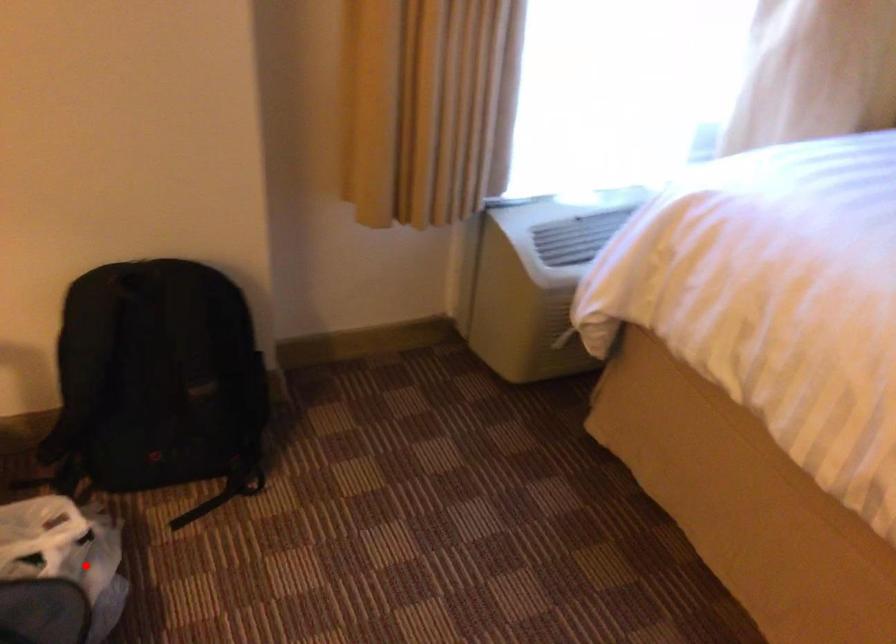
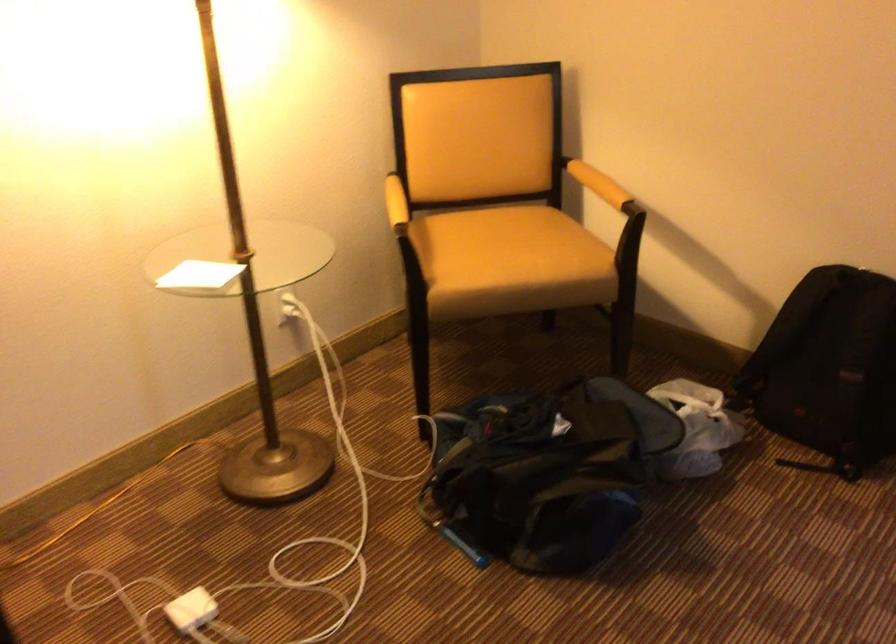
Locate, in the second image, the point that corresponds to the highlighted location in the first image.

(696, 428)